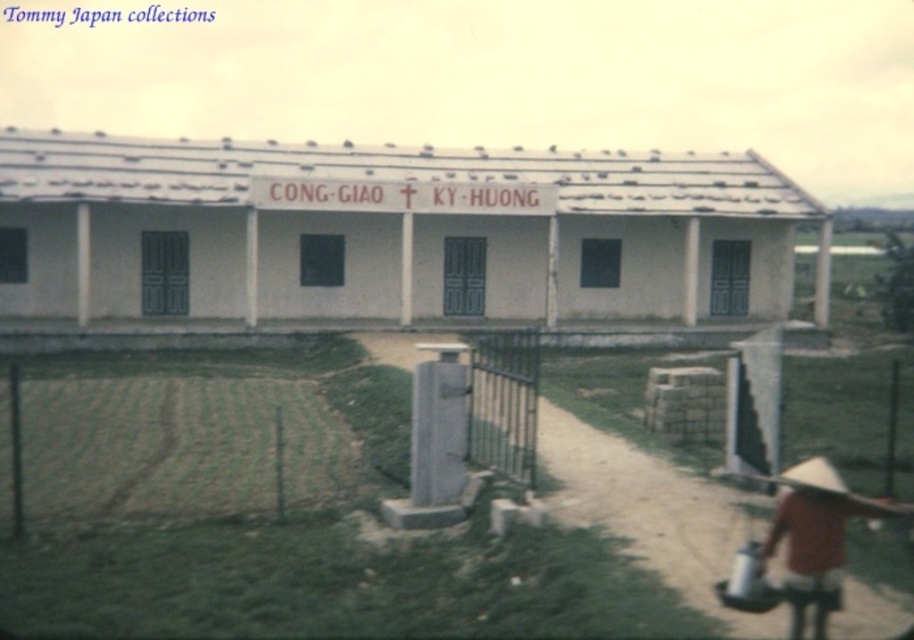
Between point (838, 563) and point (427, 376), which one is positioned behind?

The point (427, 376) is more distant.

Which is more to the left, brown straw hat at lower right or gray concrete pillar at center?

gray concrete pillar at center

This screenshot has width=914, height=640. Describe the element at coordinates (817, 529) in the screenshot. I see `brown straw hat at lower right` at that location.

Find the location of `brown straw hat at lower right`. brown straw hat at lower right is located at coordinates (817, 529).

Which of these two, metallic silver gate at center or gray concrete pillar at center, stands shorter?

Standing shorter between the two is gray concrete pillar at center.

Does metallic silver gate at center appear on the left side of gray concrete pillar at center?

In fact, metallic silver gate at center is to the right of gray concrete pillar at center.

The width and height of the screenshot is (914, 640). Identify the location of metallic silver gate at center. (505, 403).

Is point (795, 586) positioned before point (497, 410)?

Yes, it is.

Based on the photo, can you confirm if brown straw hat at lower right is positioned below metallic silver gate at center?

Correct, brown straw hat at lower right is located below metallic silver gate at center.

You are a GUI agent. You are given a task and a screenshot of the screen. Output one action in this format:
    pyautogui.click(x=<x>, y=<y>)
    Task: Click on the brown straw hat at lower right
    The width and height of the screenshot is (914, 640).
    Given the screenshot: What is the action you would take?
    pyautogui.click(x=817, y=529)